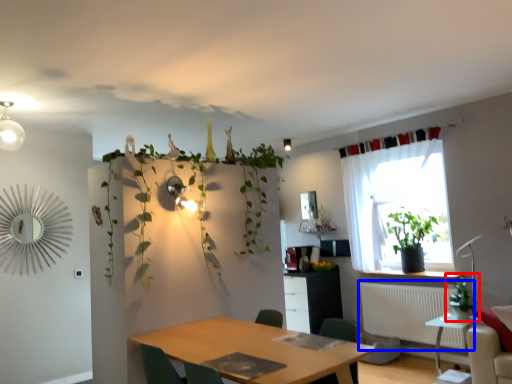
Question: Among these objects, which one is nearest to the camera, houseplant (highlighted by a red box) or radiator (highlighted by a blue box)?

Choices:
 (A) houseplant
 (B) radiator

Answer: (A)